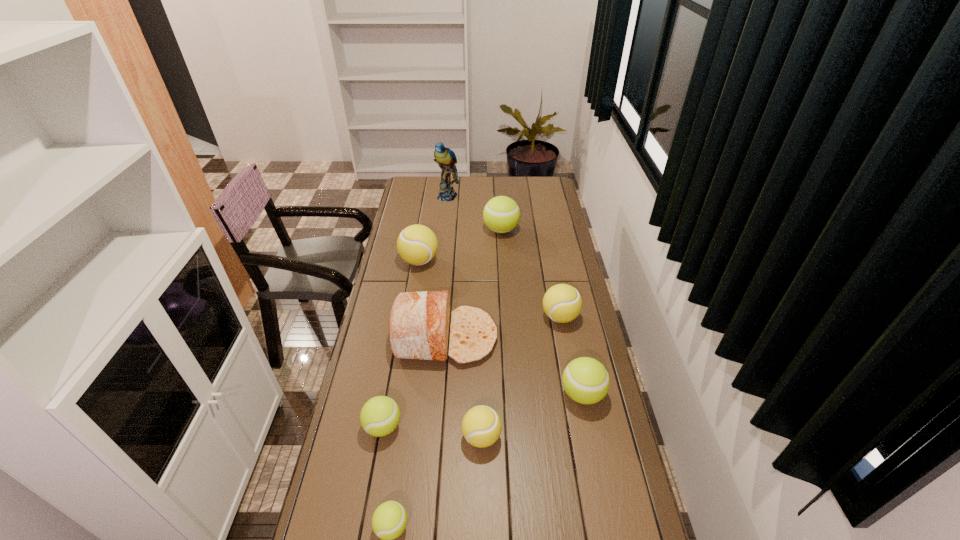
Find the location of `the second yellow tennis ball from right to left`. the second yellow tennis ball from right to left is located at coordinates (481, 426).

This screenshot has height=540, width=960. I want to click on the nearest yellow tennis ball, so click(x=481, y=426).

This screenshot has height=540, width=960. What are the coordinates of `the second smallest green tennis ball` in the screenshot? It's located at [x=380, y=415].

Locate an element on the screen. The image size is (960, 540). vacant space located 0.290m on the face of the tallest object is located at coordinates (443, 235).

Locate an element on the screen. The width and height of the screenshot is (960, 540). free space located at the sliced end of the bread is located at coordinates (542, 338).

This screenshot has width=960, height=540. Find the location of `vacant area situated on the right of the second farthest tennis ball`. vacant area situated on the right of the second farthest tennis ball is located at coordinates click(454, 261).

This screenshot has height=540, width=960. Identify the location of vacant space positioned 0.340m on the left of the farthest tennis ball. point(415,230).

Where is `blank space located 0.180m on the left of the rightmost yellow tennis ball`? blank space located 0.180m on the left of the rightmost yellow tennis ball is located at coordinates (495, 317).

The height and width of the screenshot is (540, 960). Identify the location of free space located on the left of the second biggest green tennis ball. (533, 394).

Find the location of `vacant space situated on the front of the smallest yellow tennis ball`. vacant space situated on the front of the smallest yellow tennis ball is located at coordinates (482, 524).